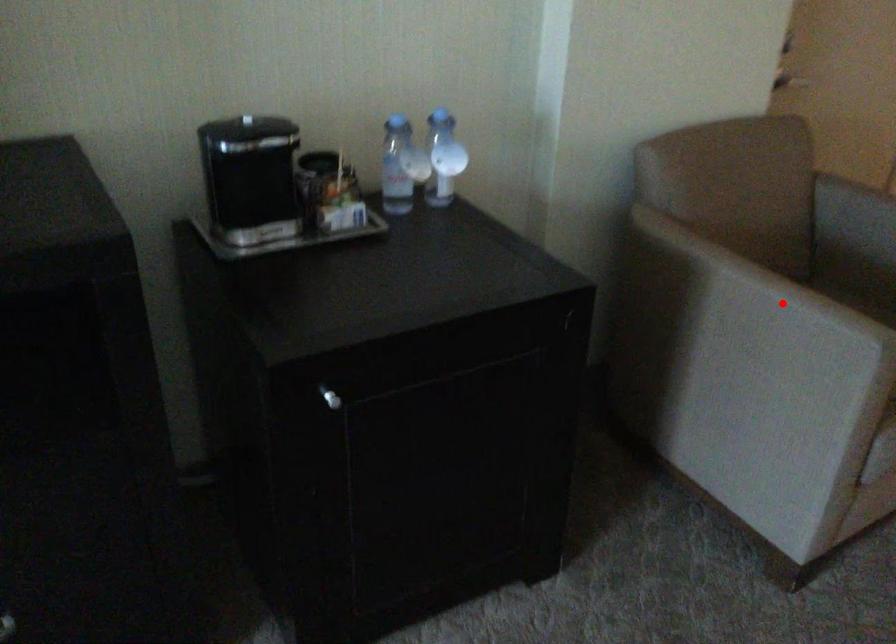
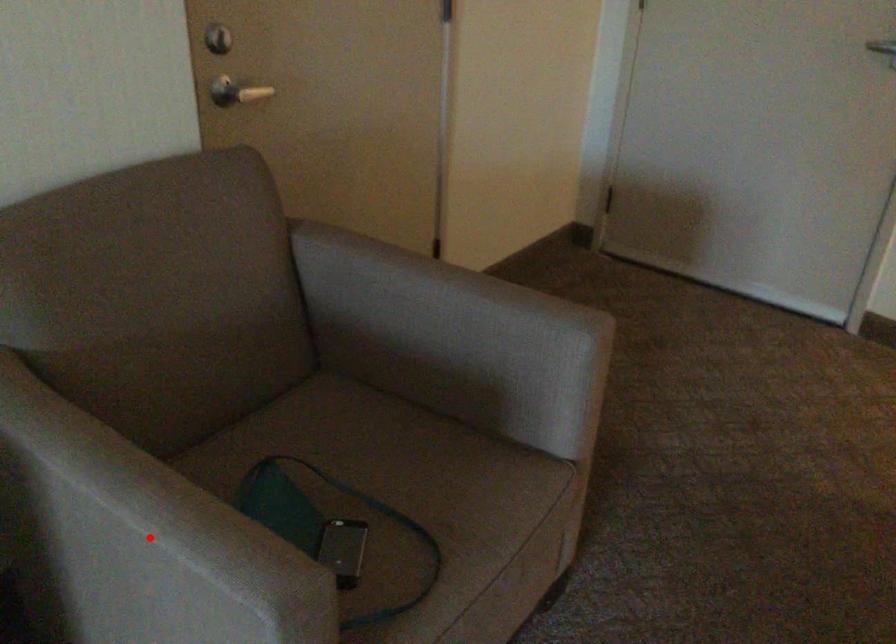
Looking at this image, I am providing you with two images of the same scene from different viewpoints. A red point is marked on the first image and another point is marked on the second image. Are the points marked in image1 and image2 representing the same 3D position?

Yes